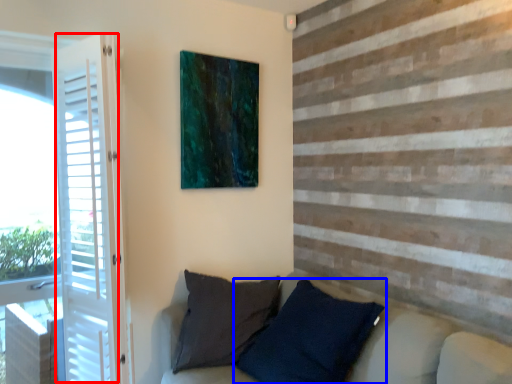
Question: Among these objects, which one is farthest to the camera, screen door (highlighted by a red box) or pillow (highlighted by a blue box)?

Choices:
 (A) screen door
 (B) pillow

Answer: (A)